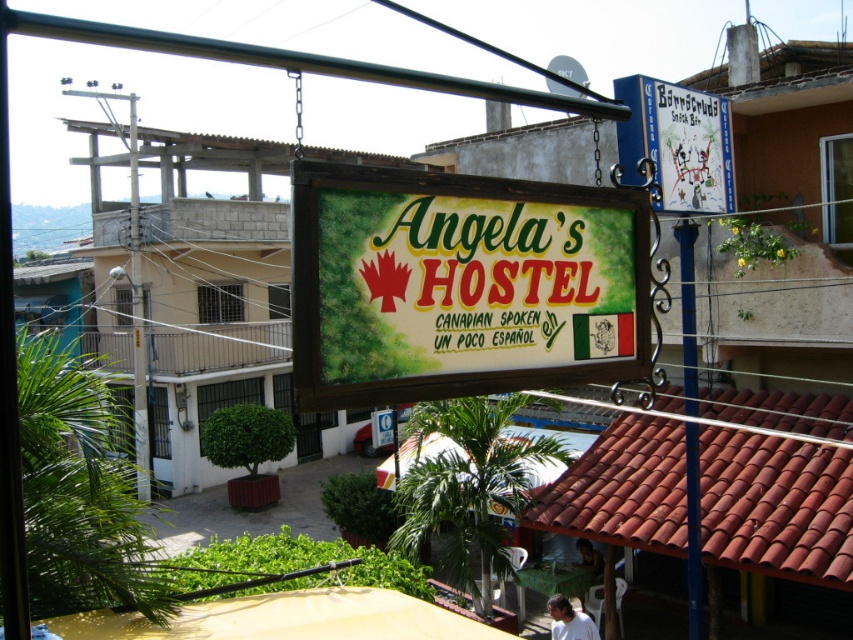
Is wooden signboard at center further to the viewer compared to white fabric shirt at lower center?

That is False.

What do you see at coordinates (461, 284) in the screenshot?
I see `wooden signboard at center` at bounding box center [461, 284].

Does point (326, 404) come behind point (584, 552)?

No, (326, 404) is closer to viewer.

In order to click on wooden signboard at center in this screenshot , I will do `click(461, 284)`.

Can you confirm if blue painted wood sign at upper right is positioned to the left of blue metal pole at center?

Yes, blue painted wood sign at upper right is to the left of blue metal pole at center.

Can you confirm if blue painted wood sign at upper right is thinner than blue metal pole at center?

Incorrect, blue painted wood sign at upper right's width is not less than blue metal pole at center's.

Find the location of a particular element. This screenshot has height=640, width=853. blue painted wood sign at upper right is located at coordinates (675, 145).

Which is behind, point (334, 320) or point (639, 88)?

The point (639, 88) is more distant.

Can you confirm if wooden signboard at center is smaller than blue painted wood sign at upper right?

Indeed, wooden signboard at center has a smaller size compared to blue painted wood sign at upper right.

Who is more distant from viewer, (421, 188) or (720, 157)?

The point (720, 157) is more distant.

You are a GUI agent. You are given a task and a screenshot of the screen. Output one action in this format:
    pyautogui.click(x=<x>, y=<y>)
    Task: Click on the wooden signboard at center
    The height and width of the screenshot is (640, 853).
    Given the screenshot: What is the action you would take?
    pyautogui.click(x=461, y=284)